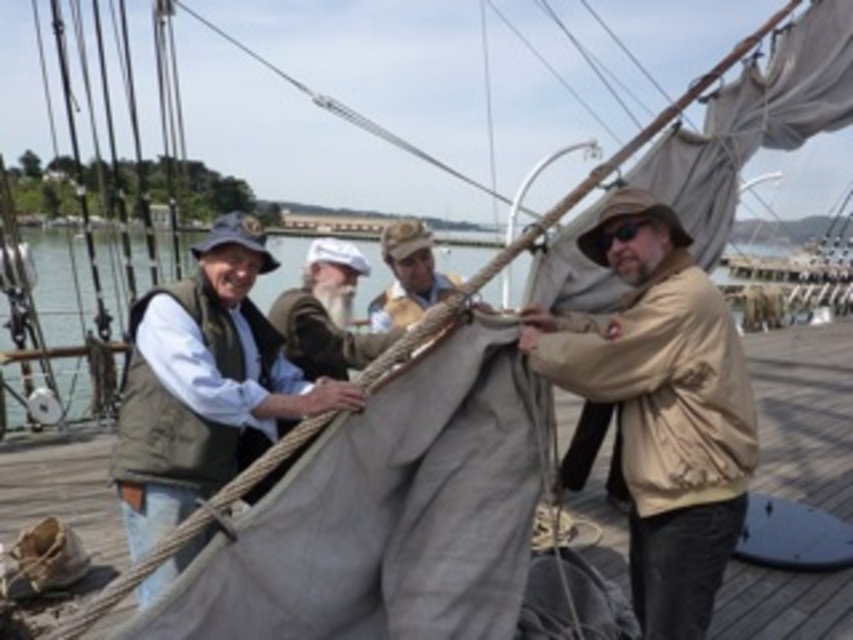
You are a sailor standing on the deck of the ship and need to reach the matte gray sail at center to adjust it. If your maximum reach is 10 feet, can you reach it?

The distance between you and the matte gray sail at center is 11.59 feet, which exceeds your maximum reach of 10 feet. Therefore, you cannot reach the matte gray sail at center without moving closer.

You are a photographer positioned at the dock and want to capture a photo of the two workers mentioned. Which worker, the tan matte jacket at center or the green canvas vest at left, will appear closer to you in the photo?

The tan matte jacket at center will appear closer to you in the photo because it is further to the viewer than the green canvas vest at left, meaning it is positioned nearer to your perspective.

You are standing at the dock and see two crew members preparing the sail. Which crew member is wearing the tan matte jacket at center located to the right of the green canvas vest at left?

The tan matte jacket at center is to the right of the green canvas vest at left, so the crew member wearing the tan matte jacket at center is positioned to the right of the one in the green canvas vest at left.